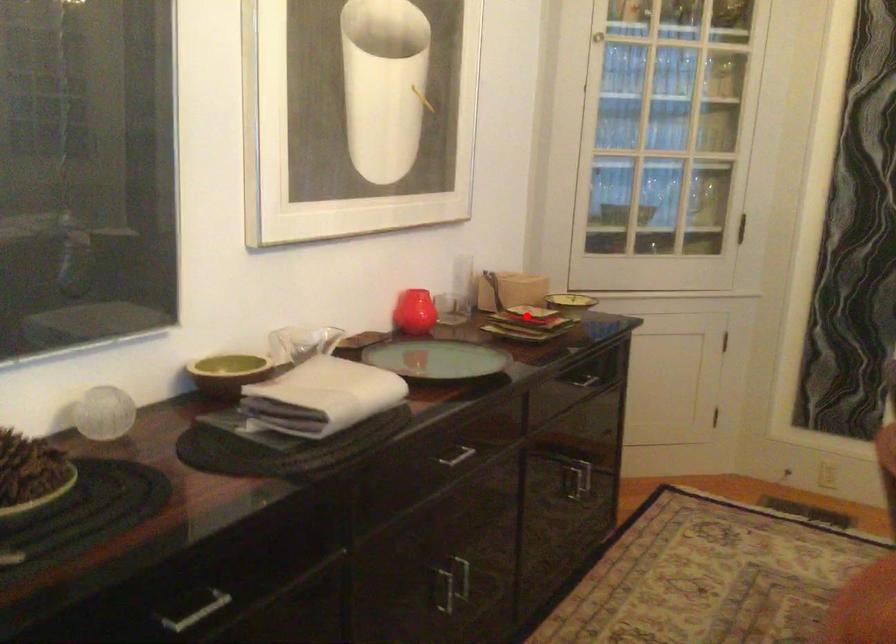
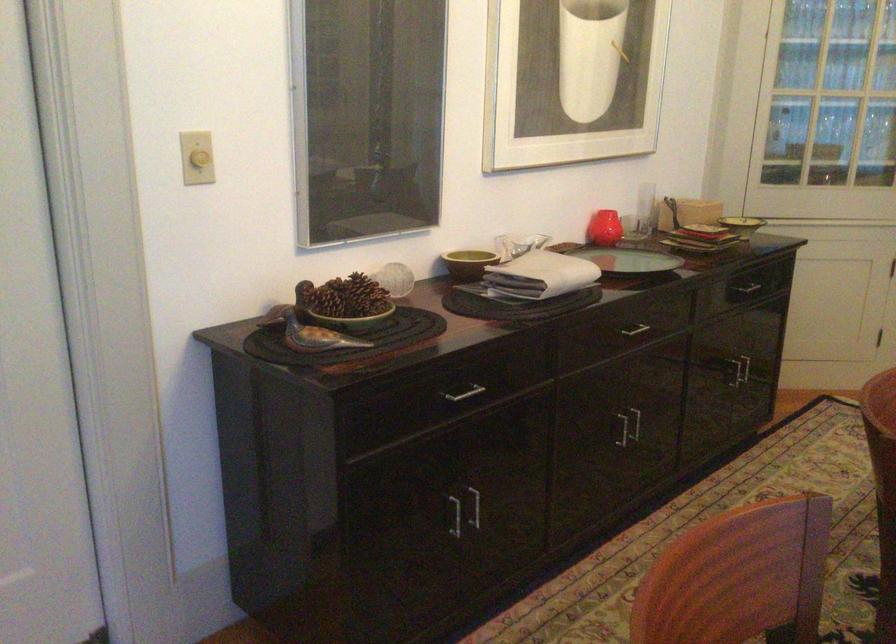
Locate, in the second image, the point that corresponds to the highlighted location in the first image.

(704, 230)